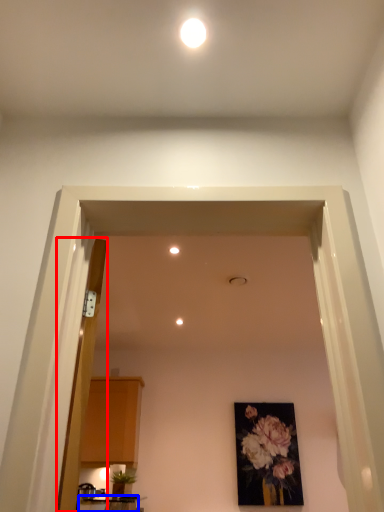
Question: Among these objects, which one is nearest to the camera, door (highlighted by a red box) or table (highlighted by a blue box)?

Choices:
 (A) door
 (B) table

Answer: (A)